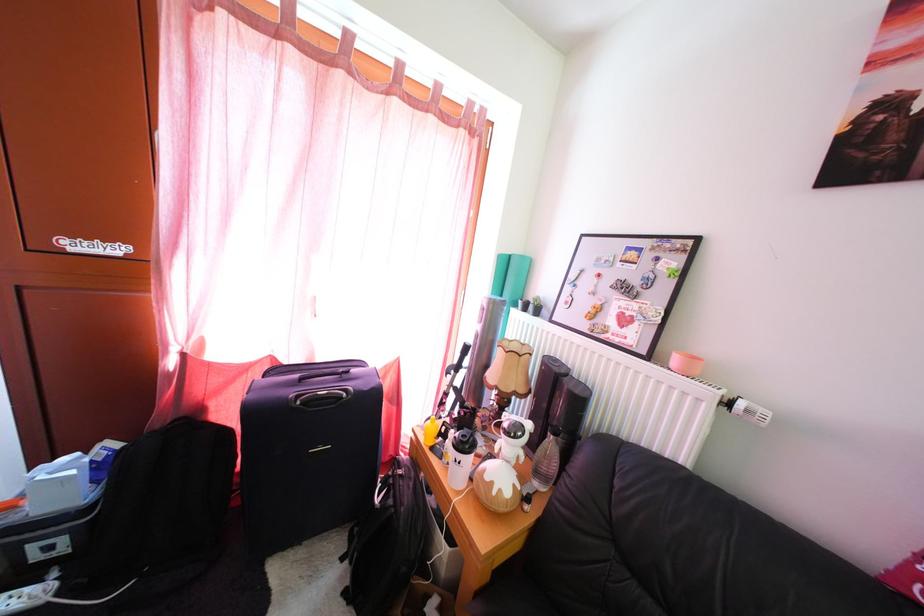
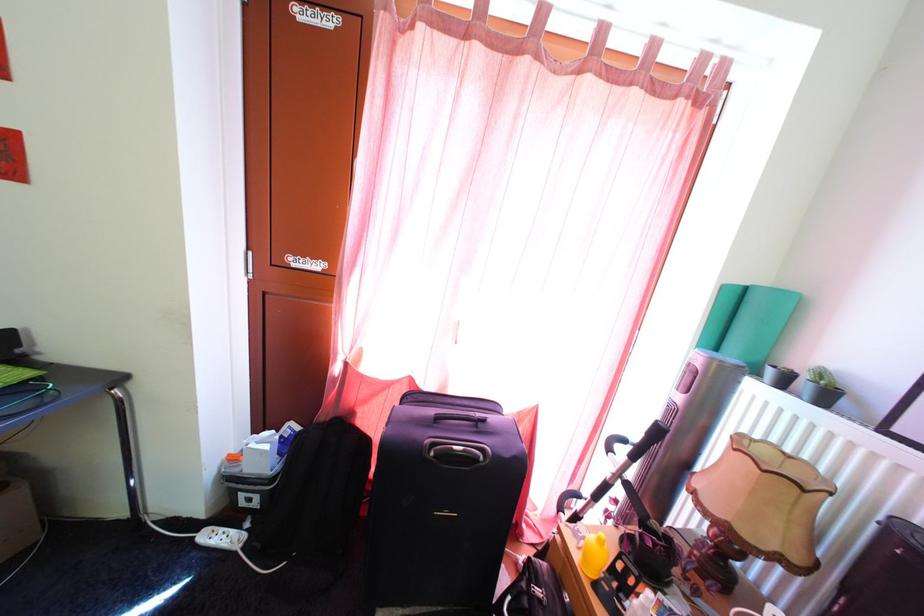
Locate, in the second image, the point that corresponds to (518,265) in the first image.

(756, 297)